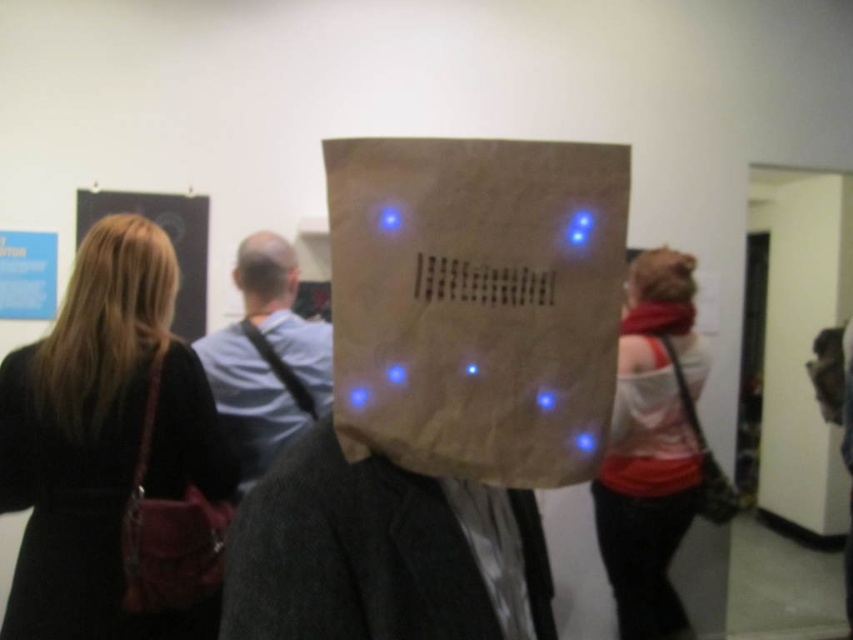
You are an art critic visiting the gallery and want to examine the black leather coat at left closely. Where exactly should you go to find it?

The black leather coat at left is located at point (114, 456).

You are an art critic standing in the gallery. You notice the black leather coat at left and the blonde hair at left. Which object is positioned more to the left side of the scene?

The black leather coat at left is positioned more to the left side of the scene than the blonde hair at left.

You are an artist trying to create a sculpture that fits between the matte white shirt at right and the smooth bald head at center. If the sculpture requires a space wider than the narrower of the two, will it fit?

The matte white shirt at right is wider than the smooth bald head at center. Since the sculpture requires a space wider than the narrower object, it can fit as the smooth bald head at center is the narrower one and the shirt is wider.